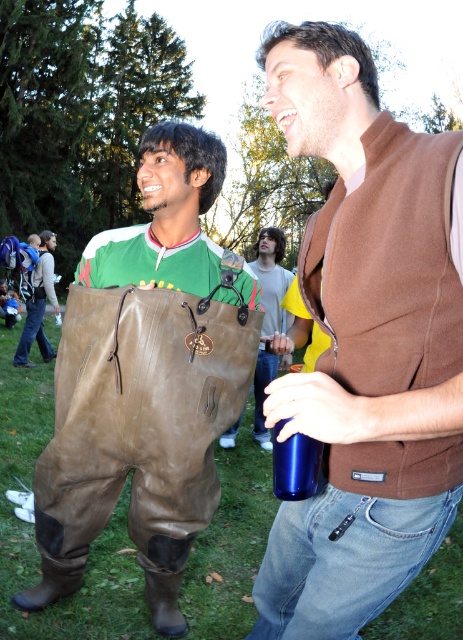
Question: Considering the real-world distances, which object is farthest from the brown wool vest at upper right?

Choices:
 (A) brown leather pants at center
 (B) brown leather bag at center

Answer: (B)

Question: Does brown leather pants at center appear on the left side of brown leather pants at lower left?

Choices:
 (A) yes
 (B) no

Answer: (B)

Question: Can you confirm if brown wool vest at upper right is positioned above brown leather bag at center?

Choices:
 (A) yes
 (B) no

Answer: (B)

Question: Is brown leather pants at center wider than brown leather bag at center?

Choices:
 (A) yes
 (B) no

Answer: (A)

Question: Which point is closer to the camera?

Choices:
 (A) brown wool vest at upper right
 (B) brown leather bag at center
 (C) brown leather pants at lower left

Answer: (A)

Question: Estimate the real-world distances between objects in this image. Which object is closer to the brown wool vest at upper right?

Choices:
 (A) brown leather bag at center
 (B) brown leather pants at center

Answer: (B)